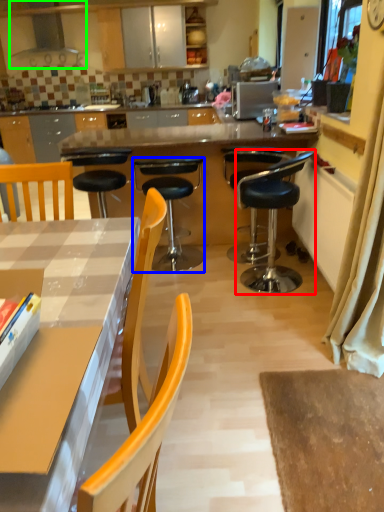
Question: Which object is the farthest from chair (highlighted by a red box)? Choose among these: chair (highlighted by a blue box) or kitchen appliance (highlighted by a green box).

Choices:
 (A) chair
 (B) kitchen appliance

Answer: (B)